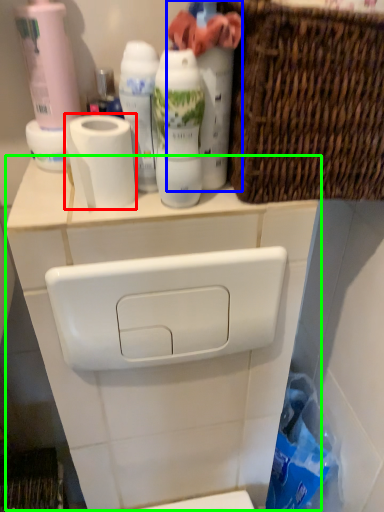
Question: Estimate the real-world distances between objects in this image. Which object is farther from toilet paper (highlighted by a red box), cleaning product (highlighted by a blue box) or counter (highlighted by a green box)?

Choices:
 (A) cleaning product
 (B) counter

Answer: (B)